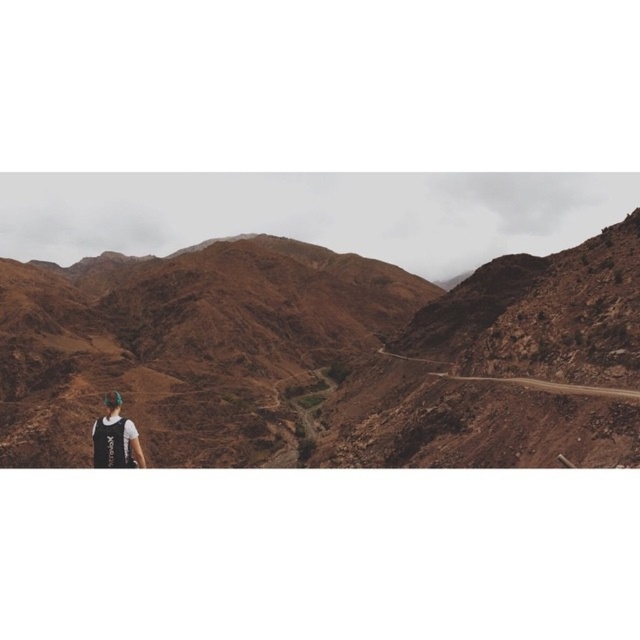
Does brown rocky mountain at center appear over dirt road at center?

Yes, brown rocky mountain at center is above dirt road at center.

Consider the image. Can you confirm if brown rocky mountain at center is bigger than dirt road at center?

Yes, brown rocky mountain at center is bigger than dirt road at center.

Between point (177, 280) and point (465, 378), which one is positioned behind?

The point (177, 280) is behind.

The width and height of the screenshot is (640, 640). I want to click on brown rocky mountain at center, so click(324, 356).

In the scene shown: Measure the distance from black fabric backpack at lower left to dirt road at center.

41.80 meters

Can you confirm if black fabric backpack at lower left is bigger than dirt road at center?

Correct, black fabric backpack at lower left is larger in size than dirt road at center.

Describe the element at coordinates (115, 436) in the screenshot. I see `black fabric backpack at lower left` at that location.

Locate an element on the screen. The height and width of the screenshot is (640, 640). black fabric backpack at lower left is located at coordinates (115, 436).

Between point (563, 362) and point (112, 436), which one is positioned in front?

Point (112, 436)

Does brown rocky mountain at center come in front of black fabric backpack at lower left?

No.

Which is behind, point (339, 337) or point (113, 435)?

The point (339, 337) is more distant.

In order to click on brown rocky mountain at center in this screenshot , I will do `click(324, 356)`.